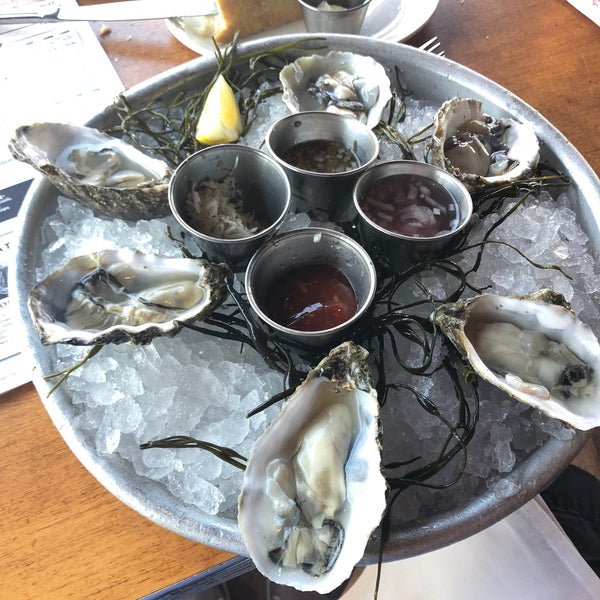
Where is `table`? This screenshot has height=600, width=600. table is located at coordinates (84, 577).